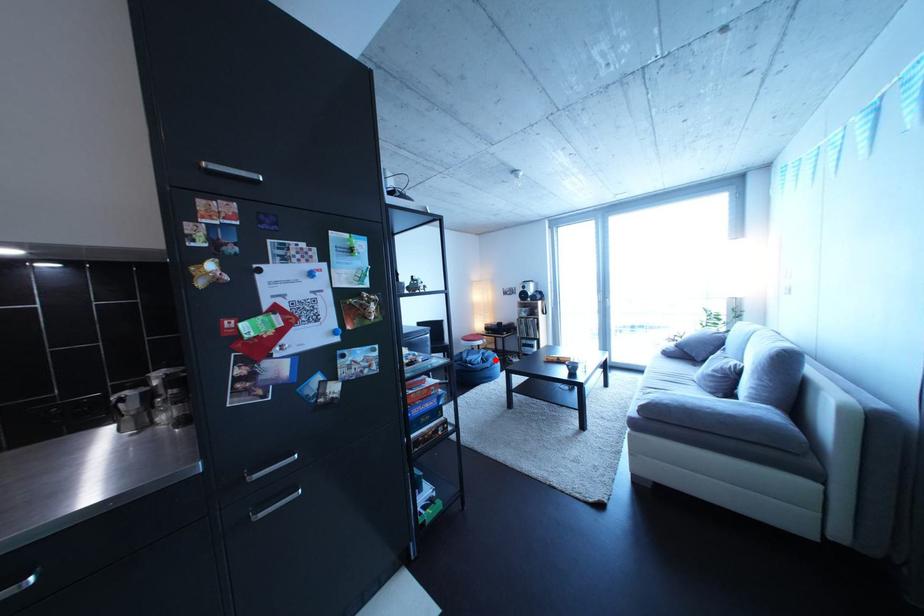
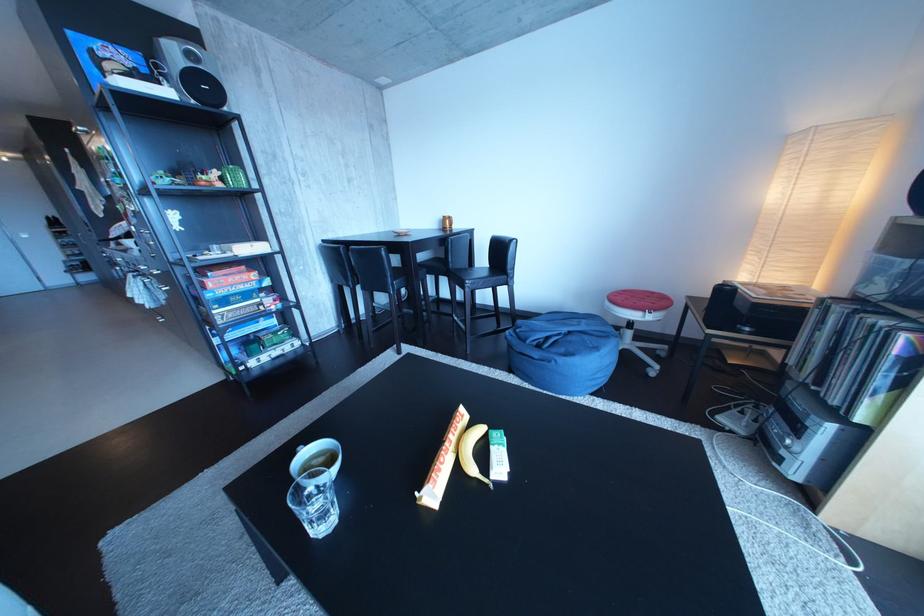
Question: I am providing you with two images of the same scene from different viewpoints. Image1 has a red point marked. In image2, the corresponding 3D location appears at what relative position? Reply with the corresponding letter.

Choices:
 (A) Closer
 (B) Farther

Answer: (B)